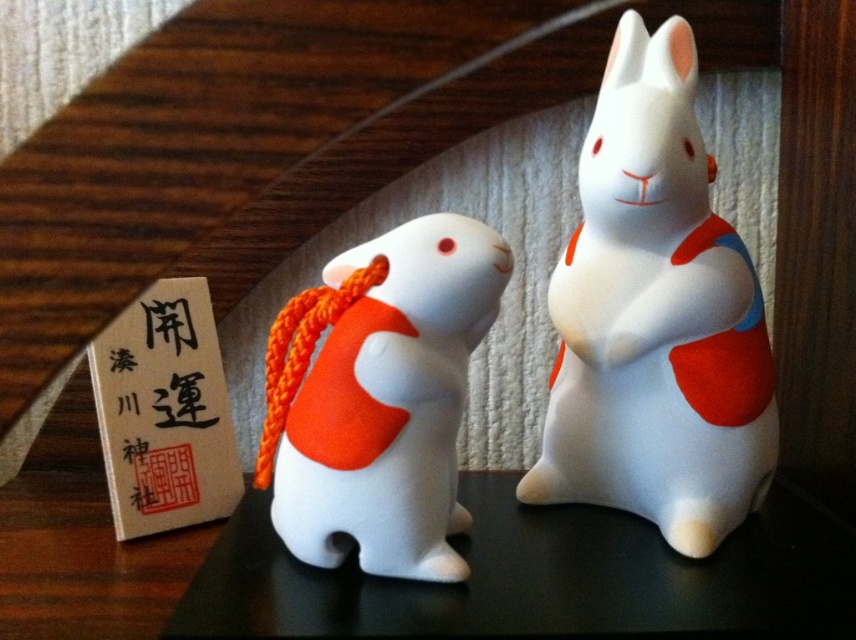
In the scene shown: Is white glossy rabbit at center to the right of white matte rabbit at center from the viewer's perspective?

Indeed, white glossy rabbit at center is positioned on the right side of white matte rabbit at center.

The image size is (856, 640). Describe the element at coordinates (655, 317) in the screenshot. I see `white glossy rabbit at center` at that location.

Find the location of `white glossy rabbit at center`. white glossy rabbit at center is located at coordinates (655, 317).